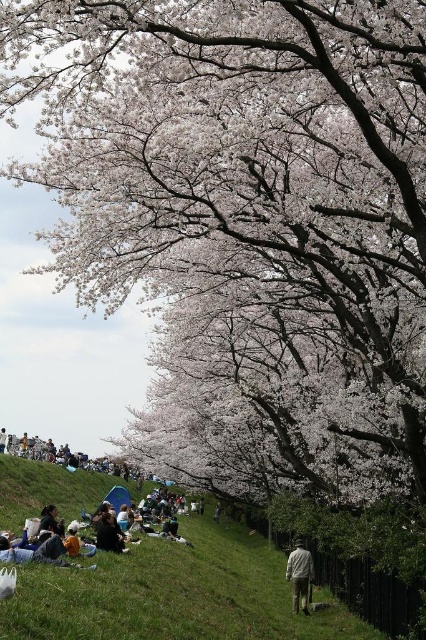
Question: Which object is closer to the camera taking this photo?

Choices:
 (A) dark brown hair at lower center
 (B) light brown fabric jacket at lower center
 (C) dark gray fabric bag at lower center
 (D) green grassy hillside at lower center

Answer: (D)

Question: Which object is the closest to the light brown fabric jacket at lower center?

Choices:
 (A) dark gray fabric bag at lower center
 (B) dark brown hair at lower center
 (C) green grassy hillside at lower center

Answer: (B)

Question: Is green grassy hillside at lower center further to the viewer compared to light brown fabric jacket at lower center?

Choices:
 (A) yes
 (B) no

Answer: (B)

Question: Is dark gray fabric bag at lower center bigger than dark brown hair at lower center?

Choices:
 (A) yes
 (B) no

Answer: (A)

Question: Which of the following is the closest to the observer?

Choices:
 (A) green grassy hillside at lower center
 (B) dark brown hair at lower center
 (C) light brown fabric jacket at lower center
 (D) dark gray fabric bag at lower center

Answer: (A)

Question: Can you confirm if light brown fabric jacket at lower center is positioned to the right of dark brown hair at lower center?

Choices:
 (A) no
 (B) yes

Answer: (B)